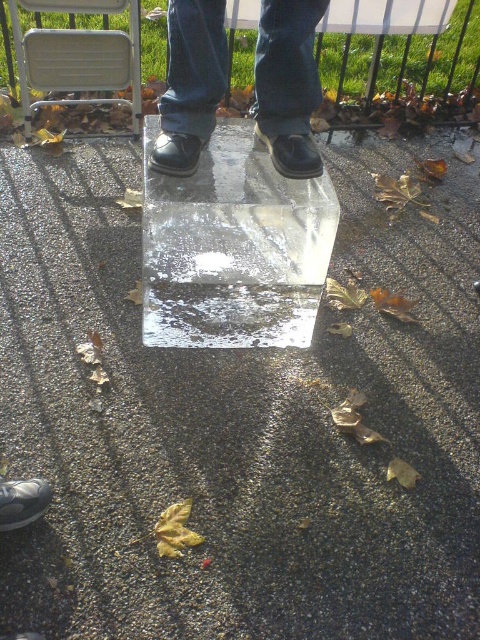
You are a delivery person who needs to place a small package on the metallic silver folding chair at upper left. You are currently standing on the matte black shoes at center. Can you reach the chair without moving your feet?

The matte black shoes at center has a lesser height compared to metallic silver folding chair at upper left, so you cannot reach the chair without moving your feet because the chair is taller than your current standing position.

You are a delivery person trying to place a package on the metallic silver folding chair at upper left. You are currently standing on the matte black shoes at center. Which direction should you move to reach the chair?

The metallic silver folding chair at upper left is further away from you than the matte black shoes at center, so you should move forward to reach it.

Looking at this image, you are standing at point (76,38) and want to move towards point (213,58). Is the path directly between these two points clear of any obstacles?

Yes, the path between point (213,58) and point (76,38) is clear because point (213,58) is in front of point (76,38), meaning there are no objects blocking the direct line between them.